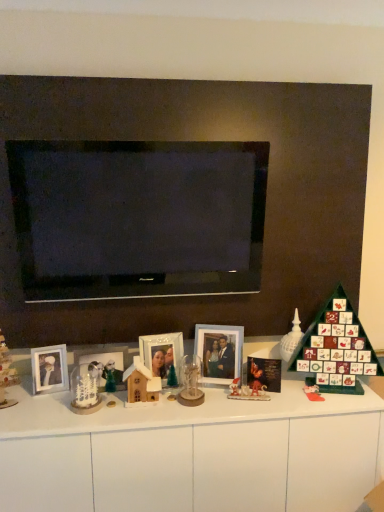
Find the location of `empty space that is to the right of matte white glass dome at lower left`. empty space that is to the right of matte white glass dome at lower left is located at coordinates (38, 408).